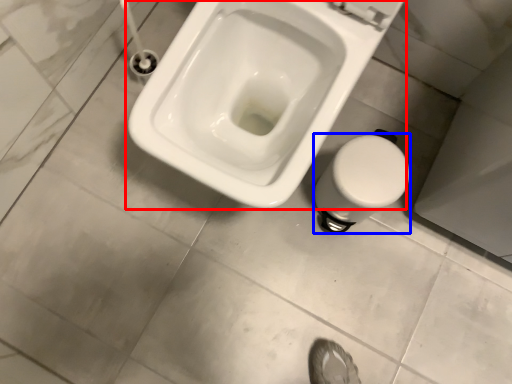
Question: Which point is closer to the camera, toilet (highlighted by a red box) or bidet (highlighted by a blue box)?

Choices:
 (A) toilet
 (B) bidet

Answer: (A)